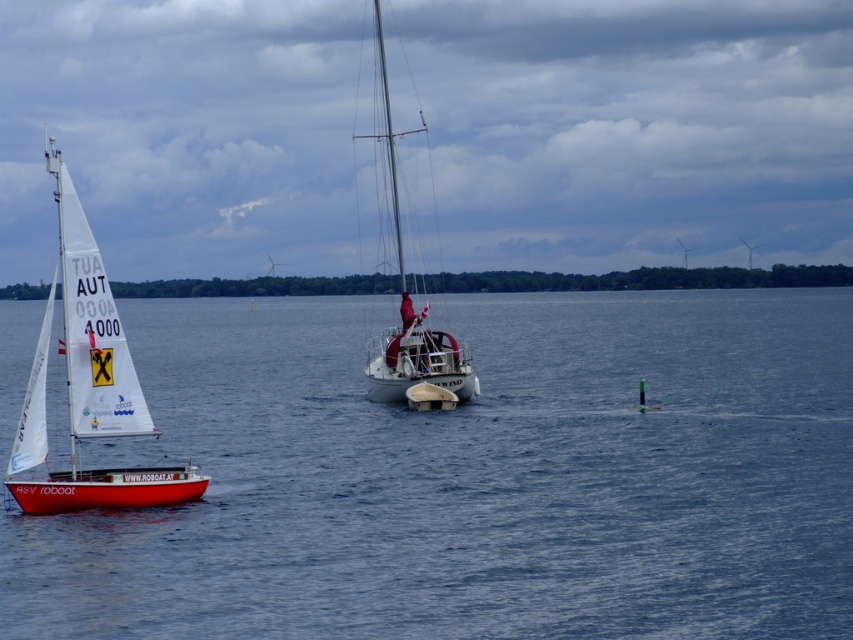
Image resolution: width=853 pixels, height=640 pixels. Identify the location of white sailboat at left. (86, 385).

Which is in front, point (53, 612) or point (80, 253)?

Point (53, 612) is in front.

Can you confirm if blue water at center is taller than white sailboat at left?

No.

Is point (769, 582) behind point (119, 477)?

No.

Image resolution: width=853 pixels, height=640 pixels. I want to click on blue water at center, so click(474, 477).

Between point (596, 364) and point (389, 333), which one is positioned in front?

Positioned in front is point (389, 333).

Which is behind, point (160, 387) or point (392, 180)?

Point (392, 180)

Image resolution: width=853 pixels, height=640 pixels. I want to click on blue water at center, so click(474, 477).